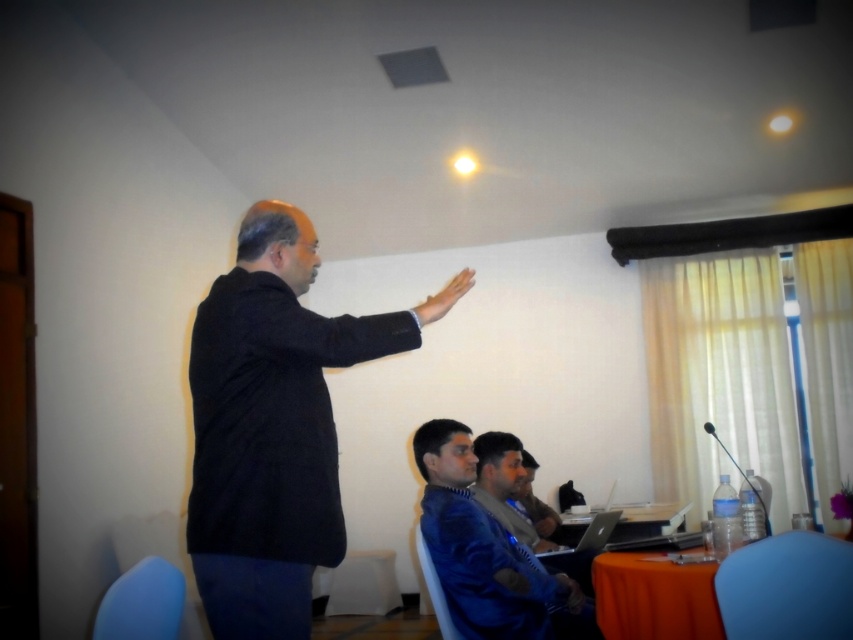
You are organizing a photoshoot and need to ensure that the black matte suit at upper left and orange fabric table at lower right are visible in the frame. Based on their sizes, which object should you prioritize positioning closer to the camera to maintain clarity?

The black matte suit at upper left should be positioned closer to the camera since it has a larger size compared to the orange fabric table at lower right, ensuring both objects remain clearly visible in the frame.

You are standing in the conference room and need to place a small plant on the orange fabric table at lower right. The table is at point (x=730, y=593). Can you walk directly to the table from your current position at point 0.5, 0.5 without encountering any obstacles?

The orange fabric table at lower right is located at point (x=730, y=593). Since there are no obstacles mentioned between your current position at 0.5, 0.5 and the table, you can walk directly to it.